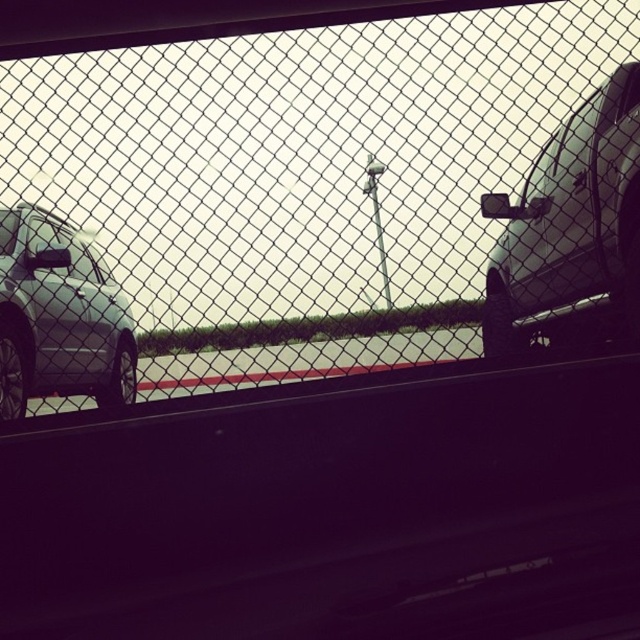
Question: Is satin silver car at right smaller than matte silver suv at left?

Choices:
 (A) no
 (B) yes

Answer: (A)

Question: Considering the relative positions of wire mesh fence at center and matte silver suv at left in the image provided, where is wire mesh fence at center located with respect to matte silver suv at left?

Choices:
 (A) left
 (B) right

Answer: (B)

Question: Among these points, which one is nearest to the camera?

Choices:
 (A) (109, 394)
 (B) (625, 140)

Answer: (B)

Question: Where is wire mesh fence at center located in relation to matte silver suv at left in the image?

Choices:
 (A) right
 (B) left

Answer: (A)

Question: Which object is farther from the camera taking this photo?

Choices:
 (A) wire mesh fence at center
 (B) matte silver suv at left

Answer: (B)

Question: Which of the following is the farthest from the observer?

Choices:
 (A) (60, 356)
 (B) (600, 211)
 (C) (113, 243)

Answer: (C)